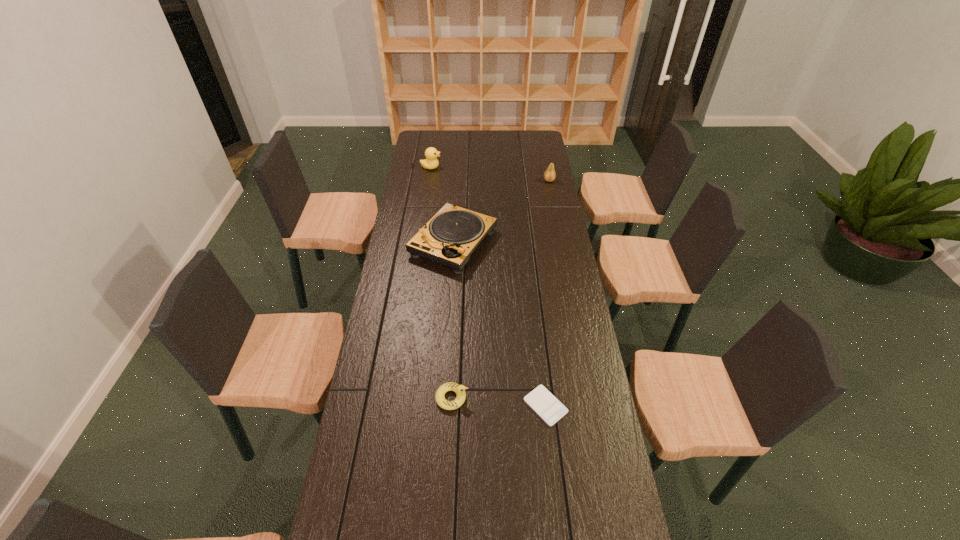
Where is `vacant space located 0.280m on the face of the second shortest object`? vacant space located 0.280m on the face of the second shortest object is located at coordinates (558, 398).

You are a GUI agent. You are given a task and a screenshot of the screen. Output one action in this format:
    pyautogui.click(x=<x>, y=<y>)
    Task: Click on the vacant space situated 0.100m on the front of the calculator
    The height and width of the screenshot is (540, 960).
    Given the screenshot: What is the action you would take?
    pyautogui.click(x=552, y=461)

Identify the location of duck at the left edge. (431, 154).

Find the location of a particular element. The image size is (960, 540). record player at the left edge is located at coordinates (449, 238).

This screenshot has height=540, width=960. I want to click on pear present at the right edge, so (x=549, y=175).

Identify the location of calculator positioned at the right edge. This screenshot has height=540, width=960. (546, 405).

Image resolution: width=960 pixels, height=540 pixels. In the image, there is a desktop. What are the coordinates of `vacant space at the left edge` in the screenshot? It's located at (417, 341).

Locate an element on the screen. This screenshot has width=960, height=540. free region at the right edge of the desktop is located at coordinates (595, 367).

Find the location of a particular element. This screenshot has width=960, height=540. free space at the far left corner of the desktop is located at coordinates (424, 143).

The image size is (960, 540). Identify the location of empty space between the shortest object and the duck. (489, 286).